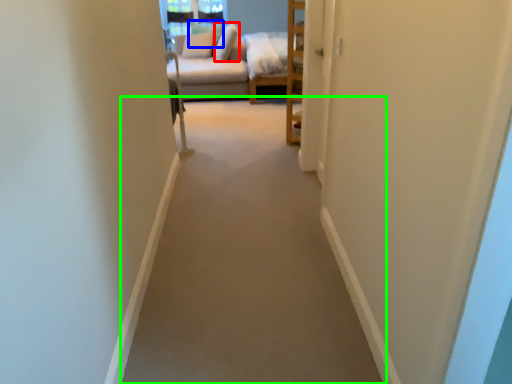
Question: Which object is the farthest from pillow (highlighted by a red box)? Choose among these: pillow (highlighted by a blue box) or path (highlighted by a green box).

Choices:
 (A) pillow
 (B) path

Answer: (B)